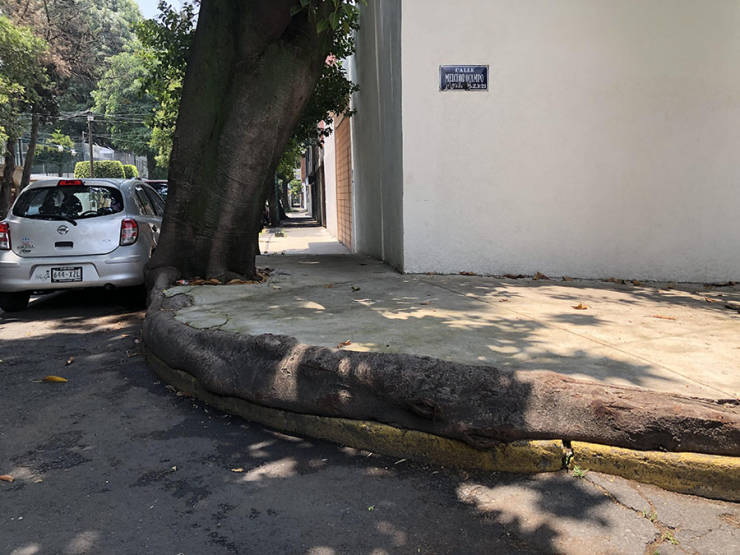
In order to click on handle in this screenshot , I will do `click(63, 244)`.